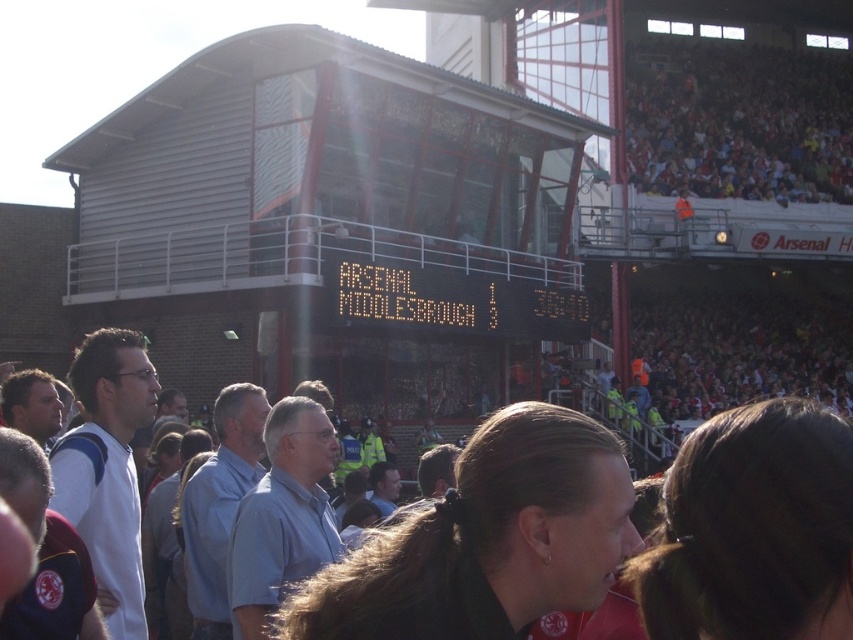
You are a photographer at the stadium and need to capture a photo that includes both the red fabric crowd at upper right and the orange digital scoreboard at center. Which object should you focus on first to ensure both are in the frame?

The red fabric crowd at upper right is bigger than the orange digital scoreboard at center, so you should focus on the red fabric crowd at upper right first to ensure both are in the frame.

You are a photographer standing in the stadium and want to capture a photo that includes both the orange digital scoreboard at center and the red fabric crowd at upper right. Based on their positions, which object should you position closer to the right side of your camera frame?

The red fabric crowd at upper right should be positioned closer to the right side of your camera frame since it is located to the right of the orange digital scoreboard at center.